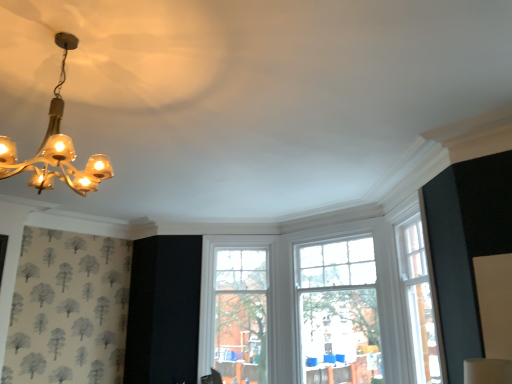
Question: From the image's perspective, would you say gold glass chandelier at upper left is shown under clear glass window at center, the second window positioned from the right?

Choices:
 (A) no
 (B) yes

Answer: (A)

Question: Can you confirm if gold glass chandelier at upper left is wider than clear glass window at center, the second window positioned from the right?

Choices:
 (A) yes
 (B) no

Answer: (A)

Question: Considering the relative sizes of gold glass chandelier at upper left and clear glass window at center, the second window positioned from the right, in the image provided, is gold glass chandelier at upper left shorter than clear glass window at center, the second window positioned from the right,?

Choices:
 (A) no
 (B) yes

Answer: (B)

Question: Does gold glass chandelier at upper left appear on the right side of clear glass window at center, which ranks as the 1th window in left-to-right order?

Choices:
 (A) yes
 (B) no

Answer: (B)

Question: Is gold glass chandelier at upper left positioned with its back to clear glass window at center, which ranks as the 1th window in left-to-right order?

Choices:
 (A) yes
 (B) no

Answer: (B)

Question: Is clear glass window at center, the second window positioned from the right, wider or thinner than gold glass chandelier at upper left?

Choices:
 (A) wide
 (B) thin

Answer: (B)

Question: From the image's perspective, is clear glass window at center, which ranks as the 1th window in left-to-right order, located above or below gold glass chandelier at upper left?

Choices:
 (A) below
 (B) above

Answer: (A)

Question: Based on their sizes in the image, would you say clear glass window at center, which ranks as the 1th window in left-to-right order, is bigger or smaller than gold glass chandelier at upper left?

Choices:
 (A) big
 (B) small

Answer: (A)

Question: Is clear glass window at center, the second window positioned from the right, situated inside gold glass chandelier at upper left or outside?

Choices:
 (A) inside
 (B) outside

Answer: (B)

Question: In terms of height, does clear glass window at center, the second window positioned from the right, look taller or shorter compared to clear glass window at center, the 1th window viewed from the right?

Choices:
 (A) short
 (B) tall

Answer: (B)

Question: Is clear glass window at center, which ranks as the 1th window in left-to-right order, inside or outside of clear glass window at center, the second window positioned from the left?

Choices:
 (A) outside
 (B) inside

Answer: (A)

Question: From the image's perspective, is clear glass window at center, the second window positioned from the right, positioned above or below clear glass window at center, the second window positioned from the left?

Choices:
 (A) below
 (B) above

Answer: (A)

Question: From a real-world perspective, is clear glass window at center, which ranks as the 1th window in left-to-right order, above or below clear glass window at center, the second window positioned from the left?

Choices:
 (A) above
 (B) below

Answer: (B)

Question: Is gold glass chandelier at upper left wider or thinner than clear glass window at center, the second window positioned from the right?

Choices:
 (A) thin
 (B) wide

Answer: (B)

Question: Considering the positions of gold glass chandelier at upper left and clear glass window at center, the second window positioned from the right, in the image, is gold glass chandelier at upper left bigger or smaller than clear glass window at center, the second window positioned from the right,?

Choices:
 (A) big
 (B) small

Answer: (B)